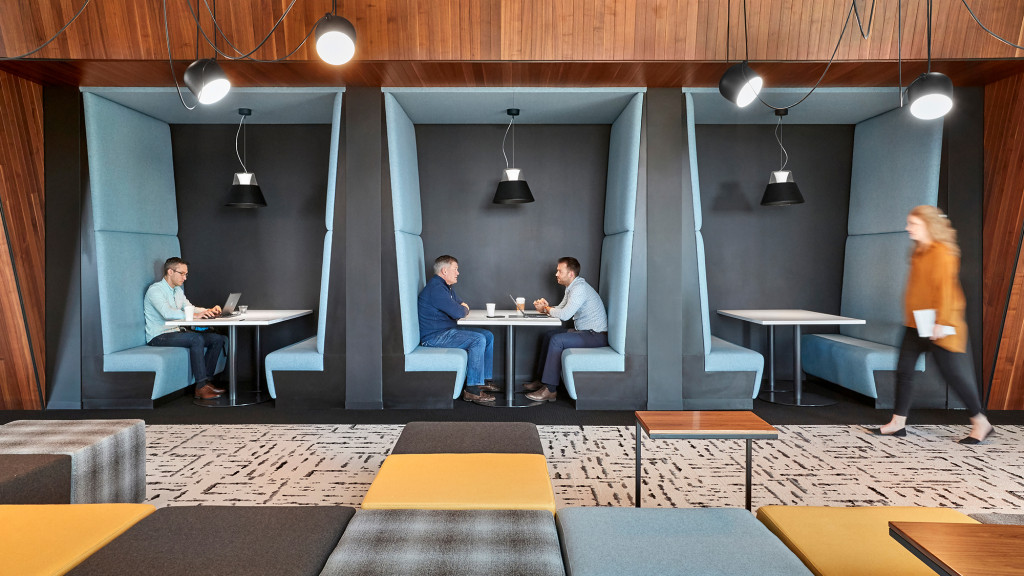
Where is `ottoman`? The width and height of the screenshot is (1024, 576). ottoman is located at coordinates (86, 458).